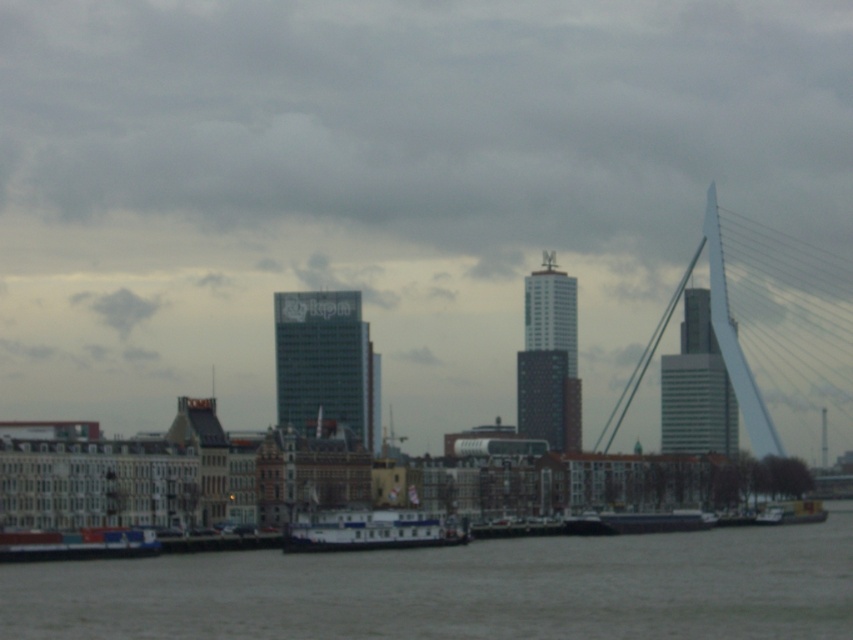
You are a photographer planning to capture the city skyline reflected in the water. You notice the gray concrete water at lower center and the white matte boat at lower center. Which object should you focus on to ensure the clearest reflection of the buildings?

The gray concrete water at lower center is in front of the white matte boat at lower center. Since calm, reflective surfaces like the gray concrete water are better for clear reflections, you should focus on the gray concrete water at lower center to capture the clearest reflection of the buildings.

You are standing on the riverbank looking at the cityscape. There are two points marked in the image. The first point is at coordinates point (436, 552) and the second is at point (776, 337). Which point is closer to you?

Point (436, 552) is closer to the viewer than point (776, 337).

You are a photographer planning to capture the cityscape from the water. You have a drone that can fly over the gray concrete water at lower center and the white matte boat at lower center. Considering their sizes, which object should you prioritize framing first in your shot to ensure it occupies more of the frame?

The gray concrete water at lower center should be prioritized as it has a larger size compared to the white matte boat at lower center, ensuring it occupies more of the frame.